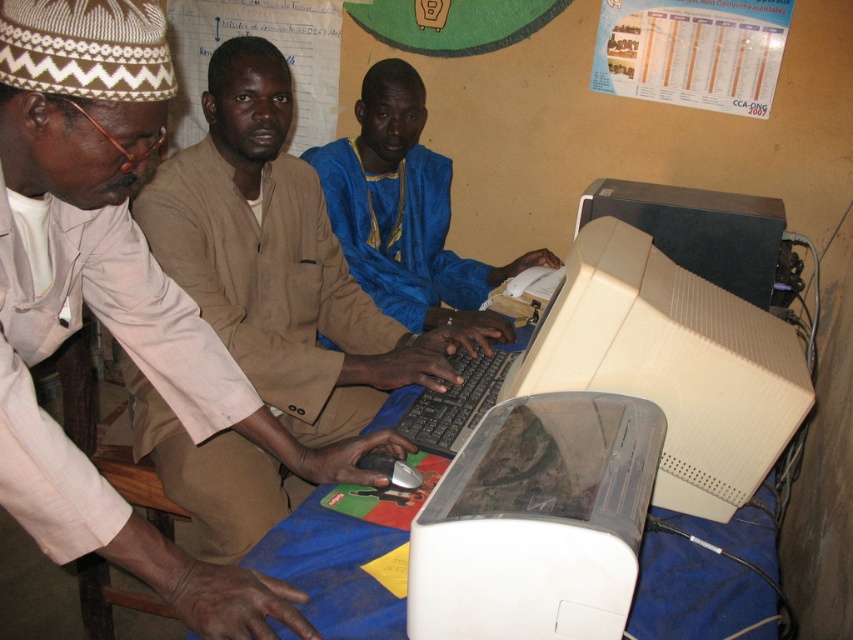
Which is more to the left, matte beige suit at center or blue satin shirt at center?

matte beige suit at center is more to the left.

This screenshot has width=853, height=640. Describe the element at coordinates (115, 305) in the screenshot. I see `matte beige suit at center` at that location.

Does point (271, 433) come closer to viewer compared to point (369, 292)?

Yes, it is in front of point (369, 292).

The height and width of the screenshot is (640, 853). I want to click on matte beige suit at center, so click(115, 305).